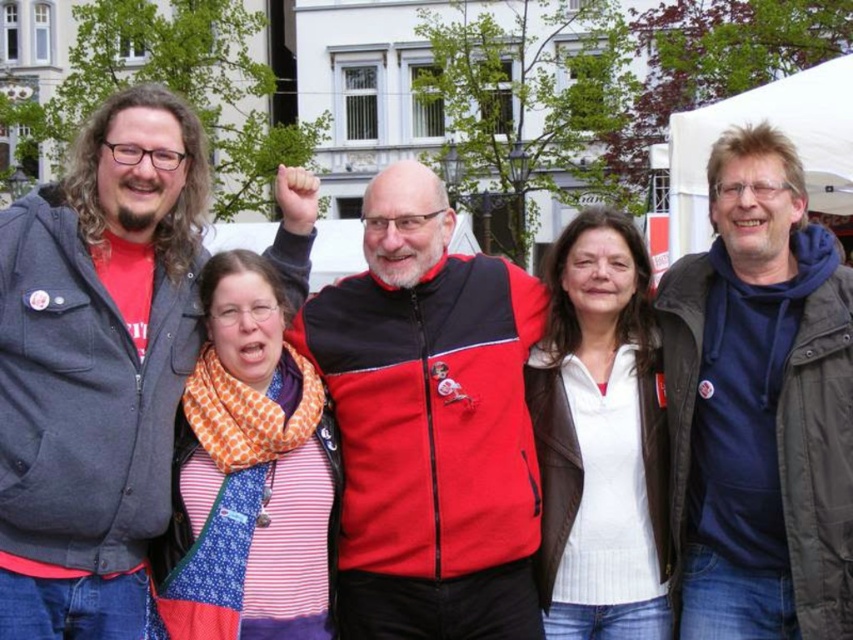
In order to click on matte gray jacket at left in this screenshot , I will do `click(96, 365)`.

Which is in front, point (193, 124) or point (393, 435)?

Point (393, 435)

The width and height of the screenshot is (853, 640). What are the coordinates of `matte gray jacket at left` in the screenshot? It's located at pyautogui.click(x=96, y=365).

At what (x,y) coordinates should I click in order to perform the action: click on red fleece jacket at center. Please return your answer as a coordinate pair (x, y). Image resolution: width=853 pixels, height=640 pixels. Looking at the image, I should click on (428, 424).

Is red fleece jacket at center shorter than dark blue fleece at right?

Yes.

Is point (428, 600) positioned after point (775, 236)?

No.

Identify the location of red fleece jacket at center. (428, 424).

How much distance is there between matte gray jacket at left and white matte jacket at center?

matte gray jacket at left is 16.22 meters away from white matte jacket at center.

Which is in front, point (120, 452) or point (606, 570)?

Point (120, 452) is in front.

Locate an element on the screen. Image resolution: width=853 pixels, height=640 pixels. matte gray jacket at left is located at coordinates (96, 365).